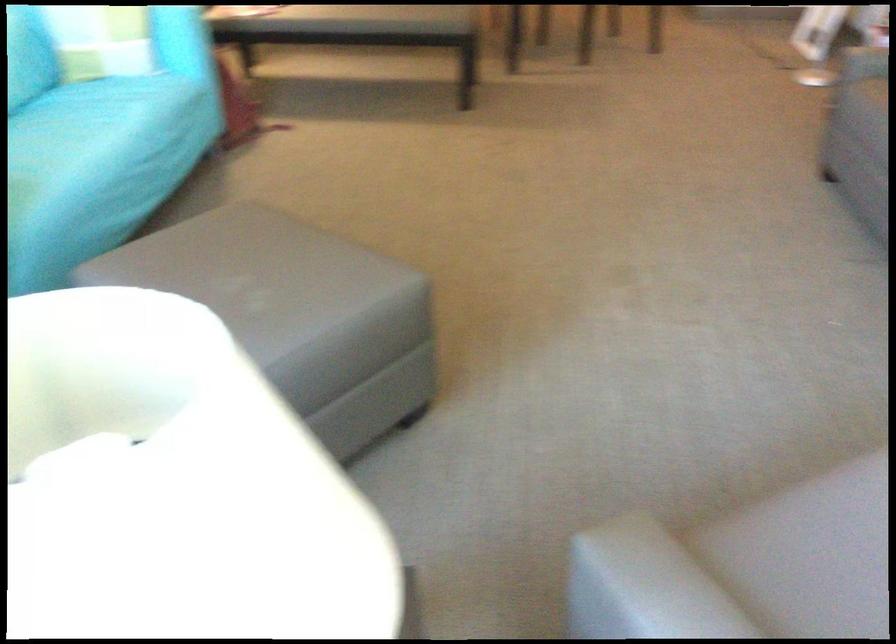
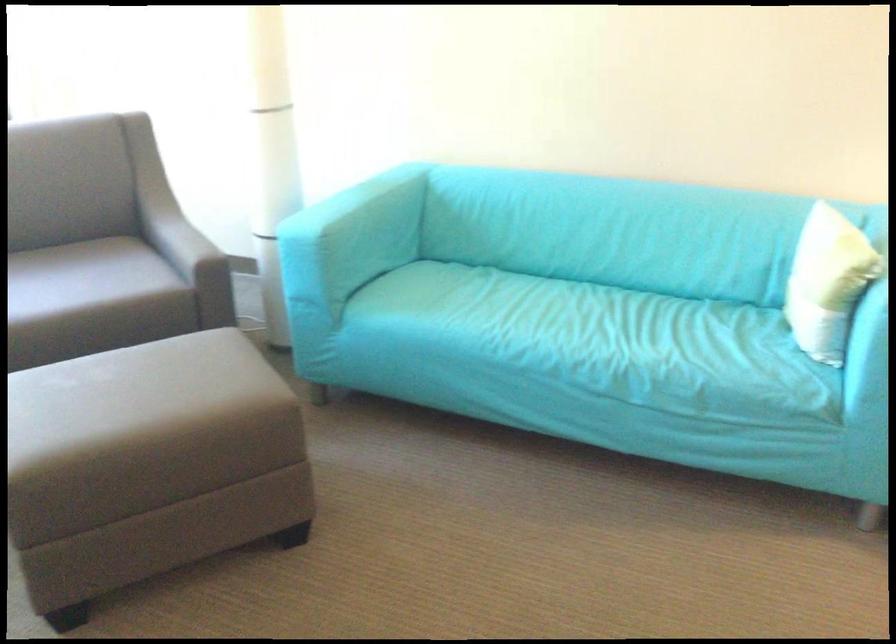
Locate, in the second image, the point that corresponds to (108,120) in the first image.

(556, 328)